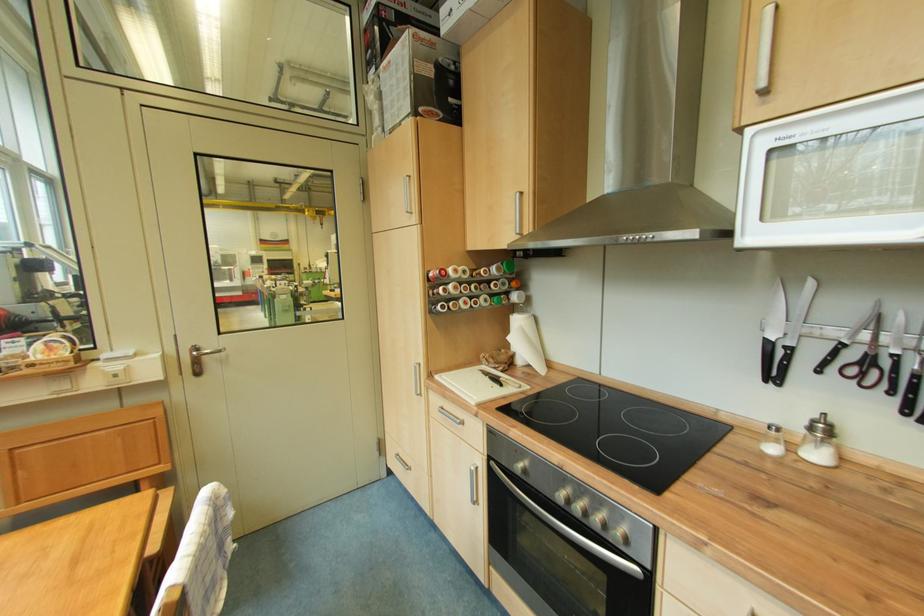
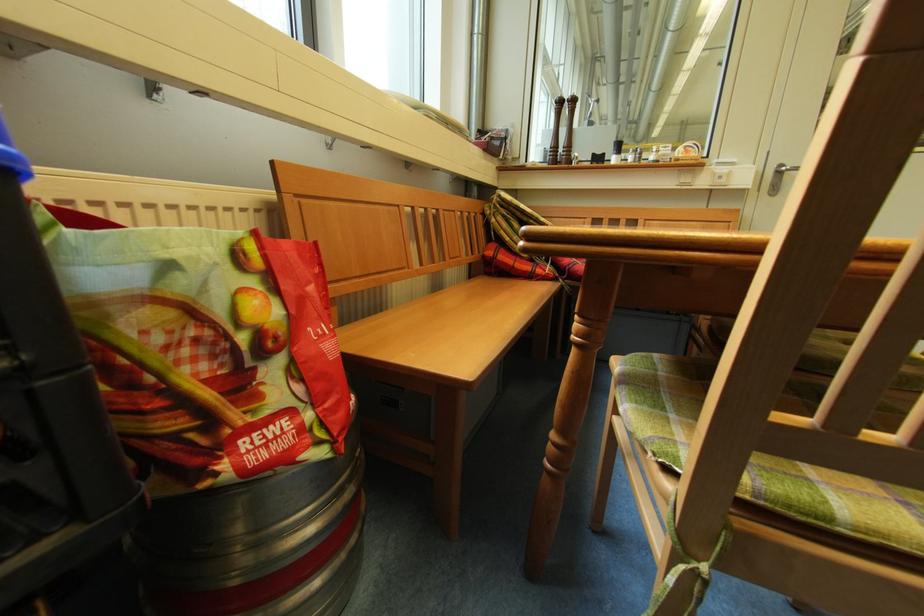
Find the pixel in the second image that matches [102,351] in the first image.

(714, 160)